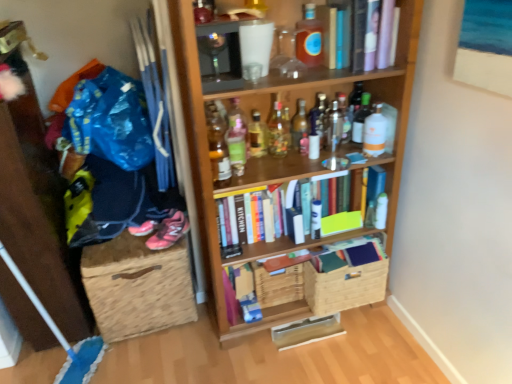
Find the location of a particular element. This screenshot has width=512, height=384. vacant area that lies between translucent glass bottle at center, arranged as the 4th bottle when viewed from the left, and translucent plastic bottle at center, the 2th bottle in the left-to-right sequence is located at coordinates (263, 170).